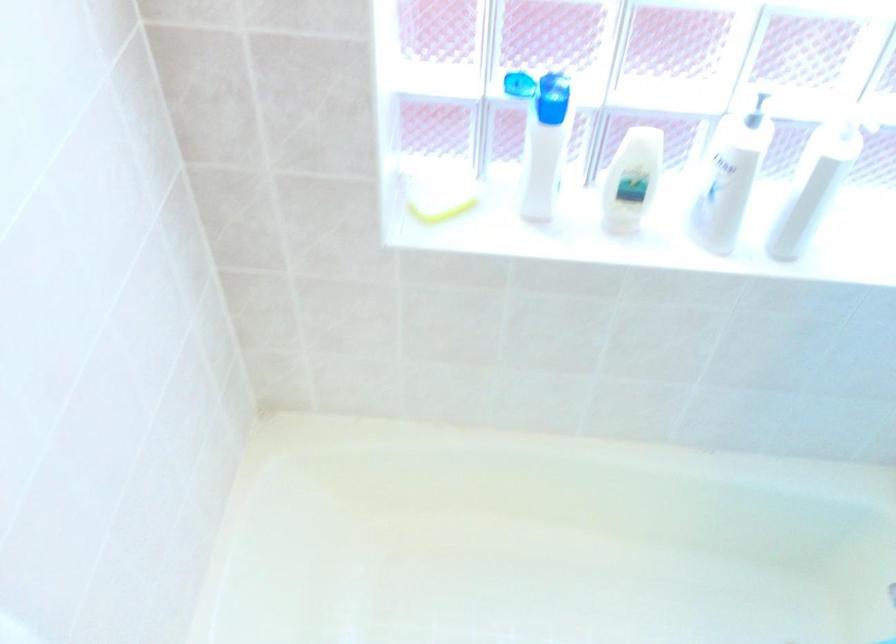
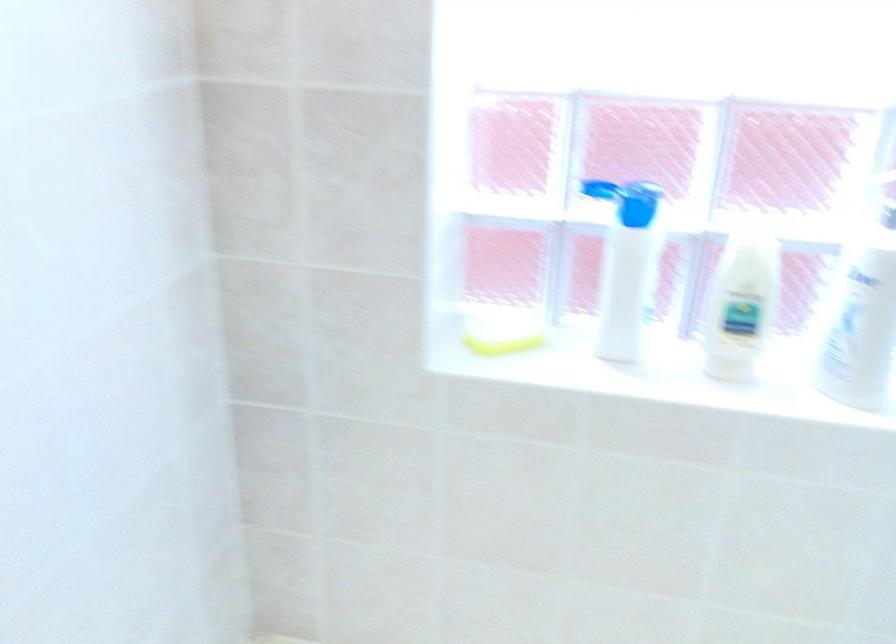
Locate, in the second image, the point that corresponds to (x=543, y=156) in the first image.

(625, 266)